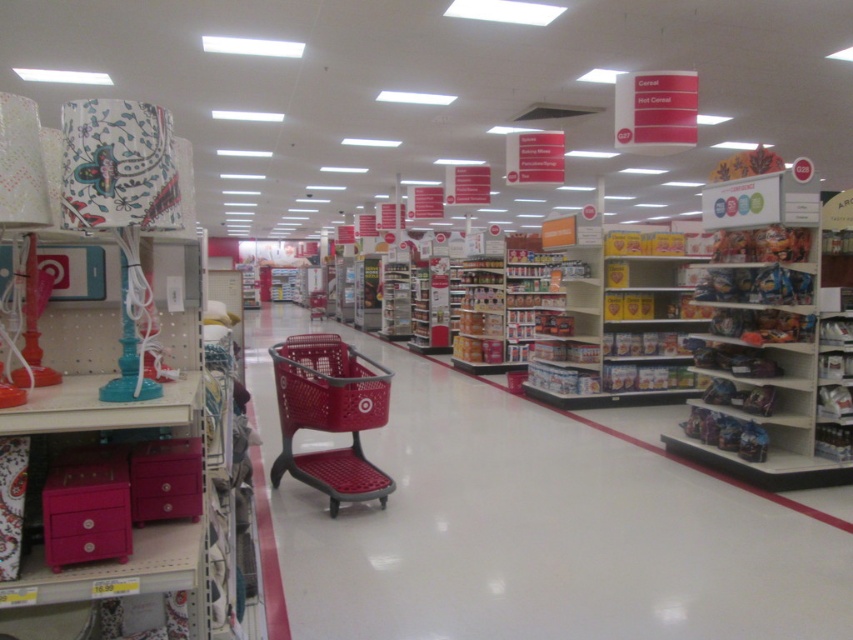
You are standing at the entrance of the retail store and want to reach the red shopping cart in the center. There are two points marked on the floor at coordinates point (309, 540) and point (293, 376). Which point is closer to your current position?

Point (309, 540) is in front of point (293, 376), so it is closer to your current position at the entrance.